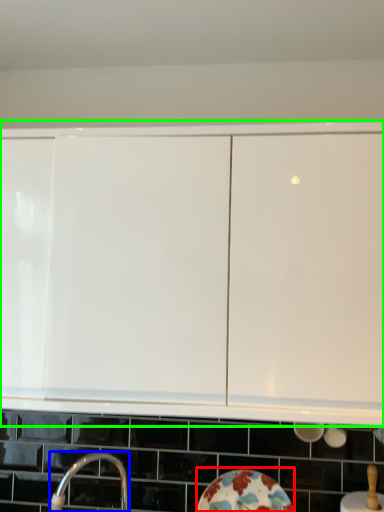
Question: Considering the real-world distances, which object is farthest from plate (highlighted by a red box)? tap (highlighted by a blue box) or cabinetry (highlighted by a green box)?

Choices:
 (A) tap
 (B) cabinetry

Answer: (B)